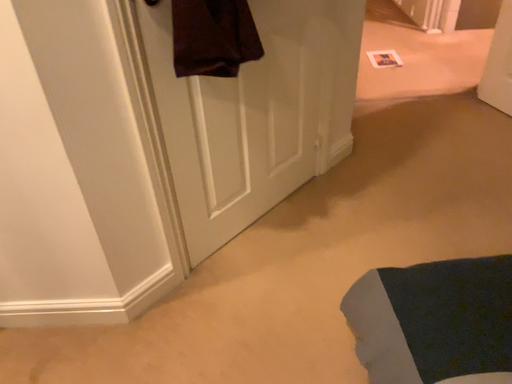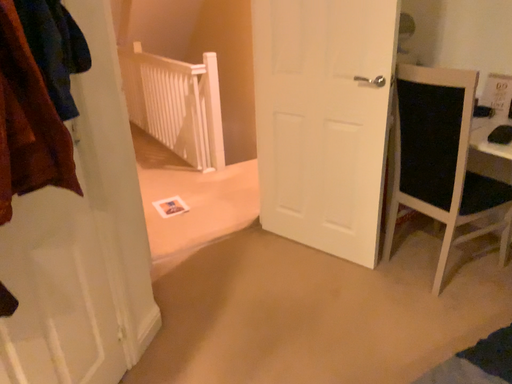
Question: Which way did the camera rotate in the video?

Choices:
 (A) rotated right
 (B) rotated left

Answer: (A)